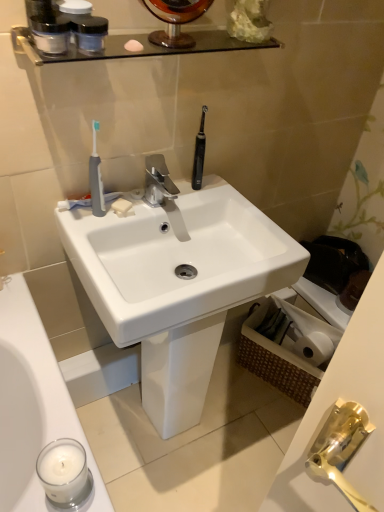
Question: Does translucent plastic containers at upper left, which appears as the 2th mouthwash when viewed from the right, have a lesser height compared to polished chrome faucet at center?

Choices:
 (A) no
 (B) yes

Answer: (B)

Question: Is translucent plastic containers at upper left, which is counted as the first mouthwash, starting from the left, next to polished chrome faucet at center?

Choices:
 (A) yes
 (B) no

Answer: (B)

Question: Is translucent plastic containers at upper left, which appears as the 2th mouthwash when viewed from the right, in front of polished chrome faucet at center?

Choices:
 (A) yes
 (B) no

Answer: (A)

Question: Is translucent plastic containers at upper left, which is counted as the first mouthwash, starting from the left, further to camera compared to polished chrome faucet at center?

Choices:
 (A) no
 (B) yes

Answer: (A)

Question: Can you confirm if translucent plastic containers at upper left, which appears as the 2th mouthwash when viewed from the right, is thinner than polished chrome faucet at center?

Choices:
 (A) no
 (B) yes

Answer: (B)

Question: Can you confirm if translucent plastic containers at upper left, which is counted as the first mouthwash, starting from the left, is wider than polished chrome faucet at center?

Choices:
 (A) no
 (B) yes

Answer: (A)

Question: Can you confirm if gray rubber toothbrush at left is taller than translucent plastic containers at upper left, which appears as the 2th mouthwash when viewed from the right?

Choices:
 (A) yes
 (B) no

Answer: (A)

Question: Could you tell me if gray rubber toothbrush at left is turned towards translucent plastic containers at upper left, which is counted as the first mouthwash, starting from the left?

Choices:
 (A) no
 (B) yes

Answer: (A)

Question: From the image's perspective, does gray rubber toothbrush at left appear higher than translucent plastic containers at upper left, which is counted as the first mouthwash, starting from the left?

Choices:
 (A) no
 (B) yes

Answer: (A)

Question: Is translucent plastic containers at upper left, which is counted as the first mouthwash, starting from the left, at the back of gray rubber toothbrush at left?

Choices:
 (A) yes
 (B) no

Answer: (B)

Question: Is gray rubber toothbrush at left closer to camera compared to translucent plastic containers at upper left, which is counted as the first mouthwash, starting from the left?

Choices:
 (A) yes
 (B) no

Answer: (B)

Question: From a real-world perspective, is gray rubber toothbrush at left located higher than translucent plastic containers at upper left, which appears as the 2th mouthwash when viewed from the right?

Choices:
 (A) no
 (B) yes

Answer: (A)

Question: Is white glossy sink at center shorter than matte black jars at upper left?

Choices:
 (A) no
 (B) yes

Answer: (A)